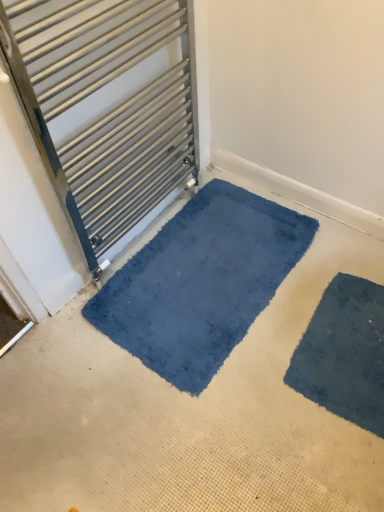
Find the location of a particular element. The width and height of the screenshot is (384, 512). vacant space that's between blue plush mat at lower center and dark blue plush bath mat at lower right is located at coordinates (278, 353).